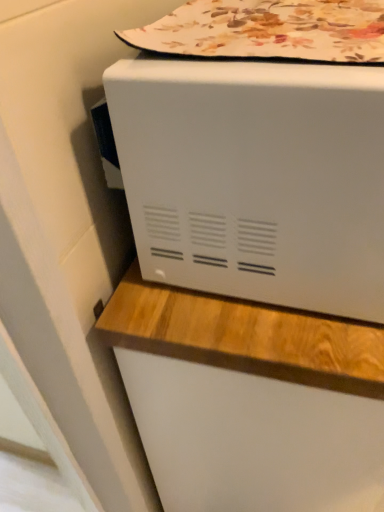
Question: In terms of width, does white matte microwave at upper center look wider or thinner when compared to floral fabric at upper center?

Choices:
 (A) thin
 (B) wide

Answer: (B)

Question: Considering the positions of point (205, 206) and point (168, 22), is point (205, 206) closer or farther from the camera than point (168, 22)?

Choices:
 (A) farther
 (B) closer

Answer: (B)

Question: From a real-world perspective, is white matte microwave at upper center physically located above or below floral fabric at upper center?

Choices:
 (A) above
 (B) below

Answer: (B)

Question: Is point (246, 50) closer or farther from the camera than point (175, 60)?

Choices:
 (A) farther
 (B) closer

Answer: (B)

Question: Is floral fabric at upper center in front of or behind white matte microwave at upper center in the image?

Choices:
 (A) front
 (B) behind

Answer: (B)

Question: In the image, is floral fabric at upper center on the left side or the right side of white matte microwave at upper center?

Choices:
 (A) right
 (B) left

Answer: (B)

Question: From the image's perspective, is floral fabric at upper center positioned above or below white matte microwave at upper center?

Choices:
 (A) above
 (B) below

Answer: (A)